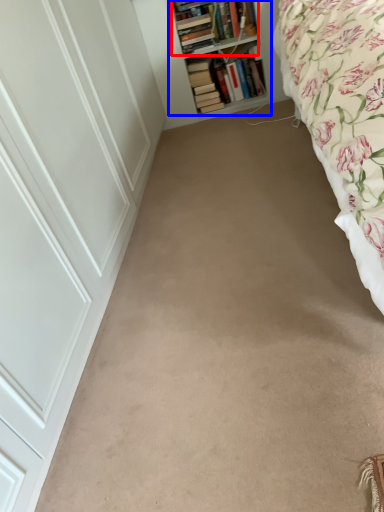
Question: Which object appears farthest to the camera in this image, book (highlighted by a red box) or shelf (highlighted by a blue box)?

Choices:
 (A) book
 (B) shelf

Answer: (A)